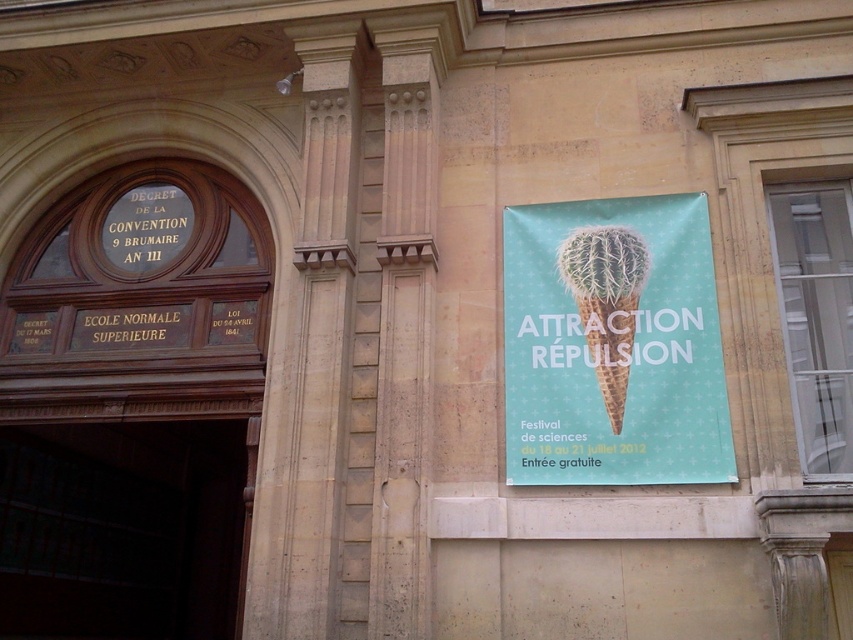
Can you confirm if green matte cactus cone at right is positioned below green textured ice cream cone at upper right?

Yes.

Which is in front, point (589, 298) or point (618, 417)?

Point (618, 417) is in front.

This screenshot has width=853, height=640. I want to click on green matte cactus cone at right, so click(x=613, y=344).